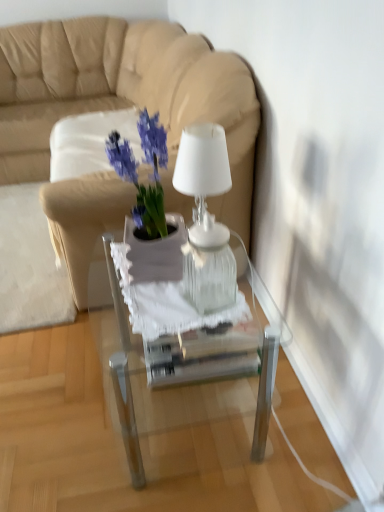
Question: Considering the relative sizes of transparent glass lamp at center and transparent glass box at center in the image provided, is transparent glass lamp at center wider than transparent glass box at center?

Choices:
 (A) no
 (B) yes

Answer: (A)

Question: Could you tell me if transparent glass lamp at center is facing transparent glass box at center?

Choices:
 (A) no
 (B) yes

Answer: (A)

Question: Does transparent glass lamp at center have a smaller size compared to transparent glass box at center?

Choices:
 (A) no
 (B) yes

Answer: (B)

Question: Does transparent glass lamp at center have a greater height compared to transparent glass box at center?

Choices:
 (A) yes
 (B) no

Answer: (A)

Question: Are transparent glass lamp at center and transparent glass box at center located far from each other?

Choices:
 (A) no
 (B) yes

Answer: (A)

Question: Considering the relative sizes of transparent glass lamp at center and transparent glass box at center in the image provided, is transparent glass lamp at center thinner than transparent glass box at center?

Choices:
 (A) yes
 (B) no

Answer: (A)

Question: Does transparent glass lamp at center come in front of beige leather couch at upper left?

Choices:
 (A) yes
 (B) no

Answer: (A)

Question: Considering the relative sizes of transparent glass lamp at center and beige leather couch at upper left in the image provided, is transparent glass lamp at center thinner than beige leather couch at upper left?

Choices:
 (A) no
 (B) yes

Answer: (B)

Question: Is transparent glass lamp at center next to beige leather couch at upper left?

Choices:
 (A) yes
 (B) no

Answer: (B)

Question: Are transparent glass lamp at center and beige leather couch at upper left located far from each other?

Choices:
 (A) no
 (B) yes

Answer: (B)

Question: Does transparent glass lamp at center have a smaller size compared to beige leather couch at upper left?

Choices:
 (A) no
 (B) yes

Answer: (B)

Question: From the image's perspective, is transparent glass lamp at center above beige leather couch at upper left?

Choices:
 (A) yes
 (B) no

Answer: (B)

Question: Can you confirm if clear glass table at center is shorter than transparent glass lamp at center?

Choices:
 (A) no
 (B) yes

Answer: (A)